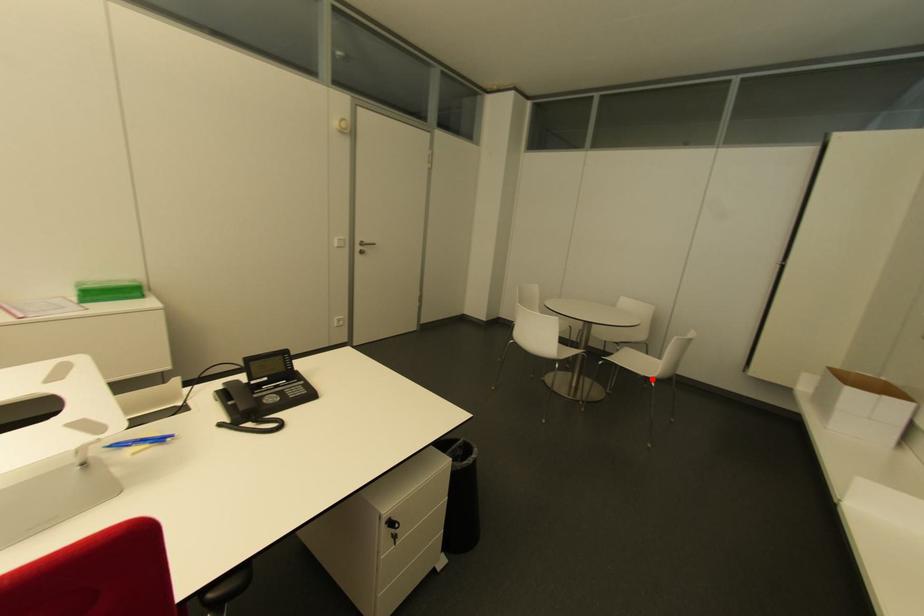
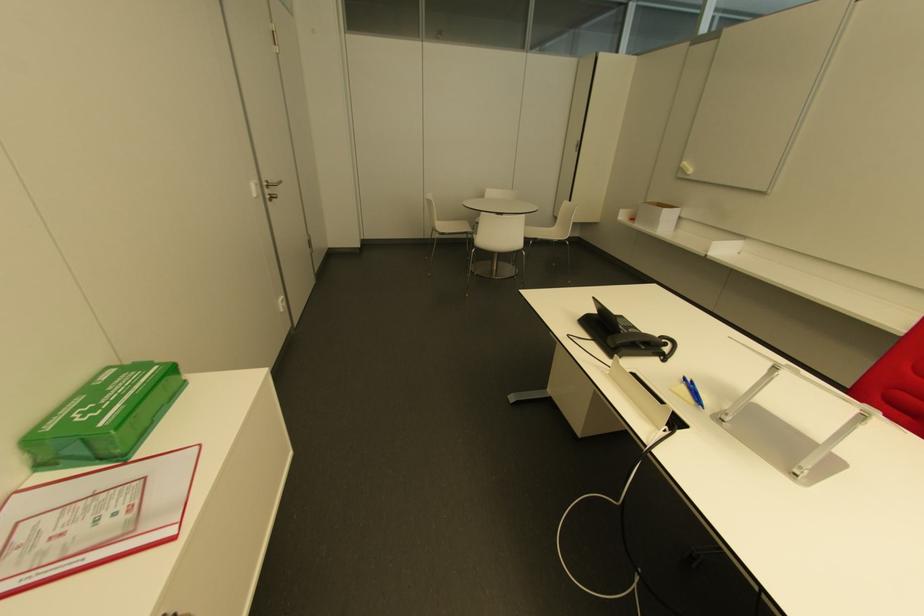
Where in the second image is the point corresponding to the highlighted location from the first image?

(565, 240)